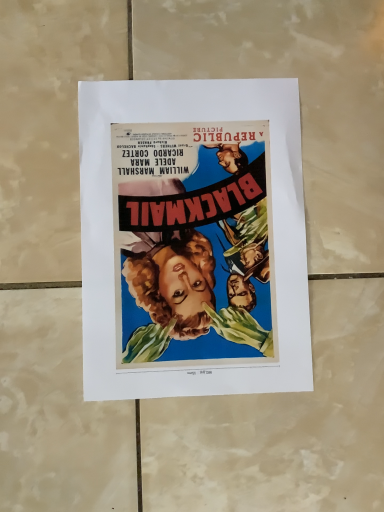
At what (x,y) coordinates should I click in order to perform the action: click on free space above matte paper poster at center (from a real-world perspective). Please return your answer as a coordinate pair (x, y). The image size is (384, 512). Looking at the image, I should click on (200, 232).